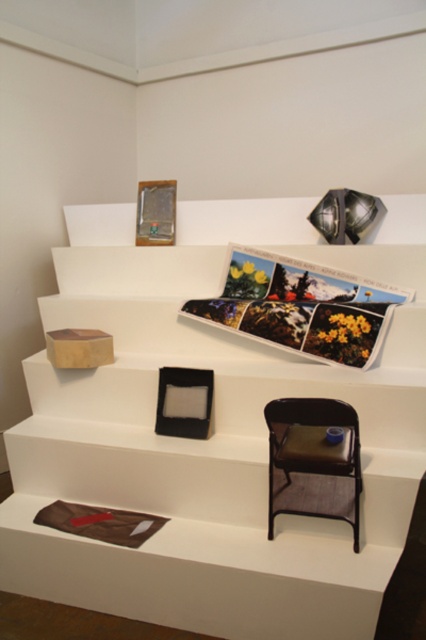
Question: Does wooden box at upper left appear under brown leather chair at lower right?

Choices:
 (A) no
 (B) yes

Answer: (A)

Question: Observing the image, what is the correct spatial positioning of wooden box at upper left in reference to brown leather chair at lower right?

Choices:
 (A) above
 (B) below

Answer: (A)

Question: In this image, where is wooden box at upper left located relative to brown leather chair at lower right?

Choices:
 (A) left
 (B) right

Answer: (A)

Question: Which point is closer to the camera?

Choices:
 (A) (325, 449)
 (B) (121, 458)

Answer: (A)

Question: Which of the following is the closest to the observer?

Choices:
 (A) (284, 465)
 (B) (206, 355)

Answer: (A)